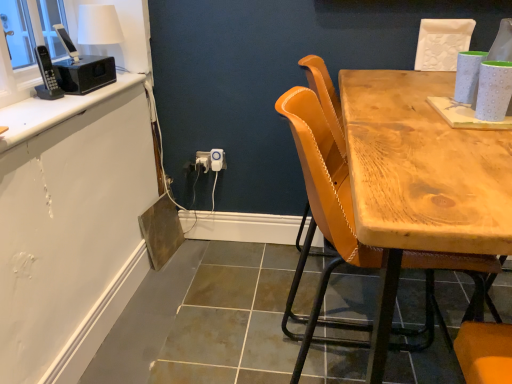
In order to click on free location above white glossy countertop at upper left (from a real-world perspective) in this screenshot , I will do (59, 106).